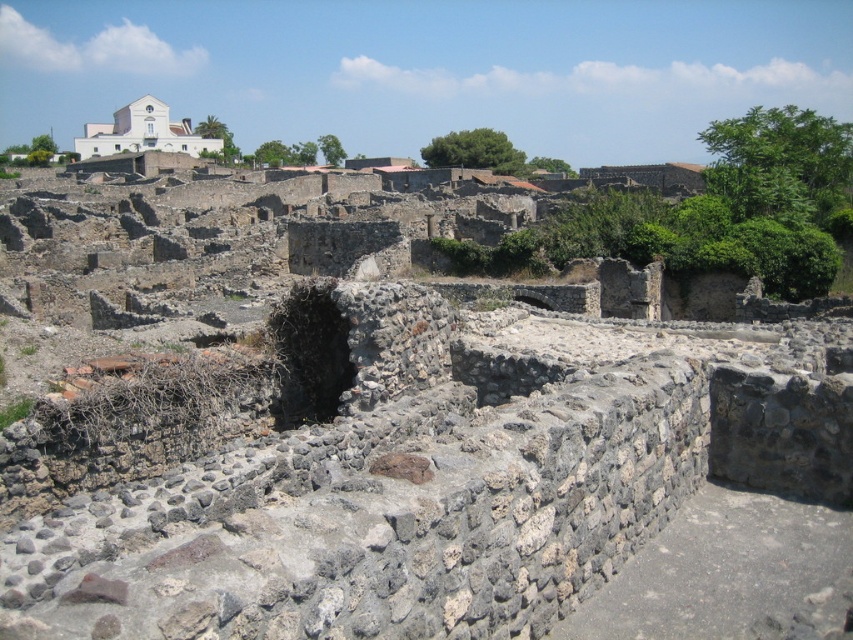
You are an archaeologist exploring the site and need to locate the dark stone hole at center. From your current position near the white stone building at upper left, in which direction should you move to reach it?

The dark stone hole at center is positioned on the right side of white stone building at upper left, so you should move to the right from the white stone building at upper left to reach it.

You are an archaeologist standing at the edge of the site. You see the dark stone hole at center and the white stone building at upper left. Which structure is physically closer to you?

The dark stone hole at center is closer to the viewer than the white stone building at upper left, so the dark stone hole at center is physically closer to you.

You are an archaeologist standing at the archaeological site. You notice a dark stone hole at center that you want to investigate. If your measuring device indicates that the distance to the hole is 177.58 feet, is it within a safe walking distance for you to reach it without any equipment?

The dark stone hole at center is 177.58 feet away from the viewer. Since this distance is quite far, it may not be safe to walk that distance on the unstable archaeological site without proper equipment. You should consider using equipment or assessing the terrain first before proceeding.